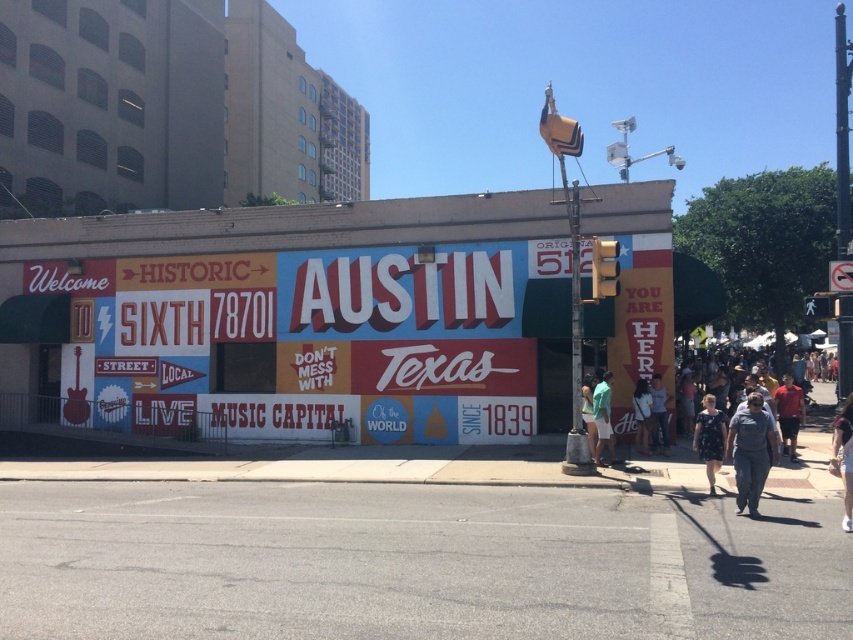
Question: Which object appears closest to the camera in this image?

Choices:
 (A) matte painted sign at center
 (B) dark floral dress at lower right
 (C) red shirt at right
 (D) dark blue denim shorts at lower right

Answer: (D)

Question: Which of the following is the closest to the observer?

Choices:
 (A) white fabric shirt at lower right
 (B) dark blue denim shorts at lower right

Answer: (B)

Question: Does white cotton shirt at lower right appear under green fabric pants at lower right?

Choices:
 (A) yes
 (B) no

Answer: (A)

Question: Can you confirm if gray cotton shirt at center is positioned above green fabric pants at lower right?

Choices:
 (A) no
 (B) yes

Answer: (B)

Question: Which of the following is the farthest from the observer?

Choices:
 (A) (786, 410)
 (B) (635, 396)
 (C) (665, 426)

Answer: (C)

Question: From the image, what is the correct spatial relationship of red shirt at right in relation to green fabric shorts at lower right?

Choices:
 (A) below
 (B) above

Answer: (B)